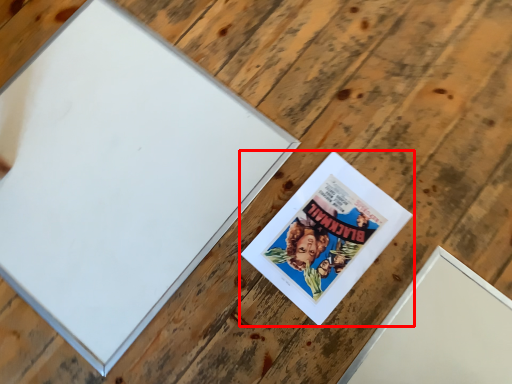
Question: From the image's perspective, what is the correct spatial positioning of picture frame (annotated by the red box) in reference to picture frame?

Choices:
 (A) above
 (B) below

Answer: (B)